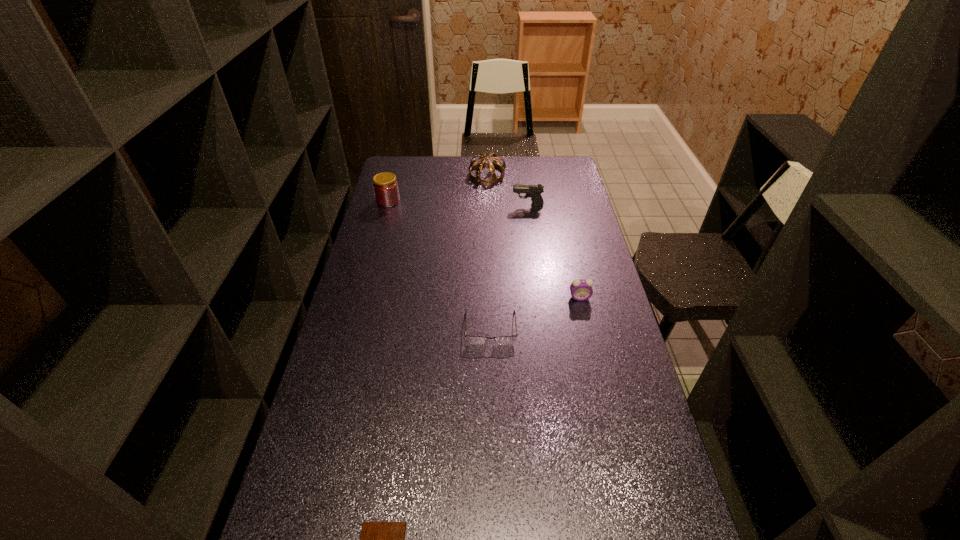
Choose which object is the nearest neighbor to the second object from left to right. Please provide its 2D coordinates. Your answer should be formatted as a tuple, i.e. [(x, y)], where the tuple contains the x and y coordinates of a point satisfying the conditions above.

[(478, 340)]

This screenshot has height=540, width=960. Identify the location of free region that satisfies the following two spatial constraints: 1. at the barrel of the third tallest object; 2. on the front-facing side of the spectacles. (545, 328).